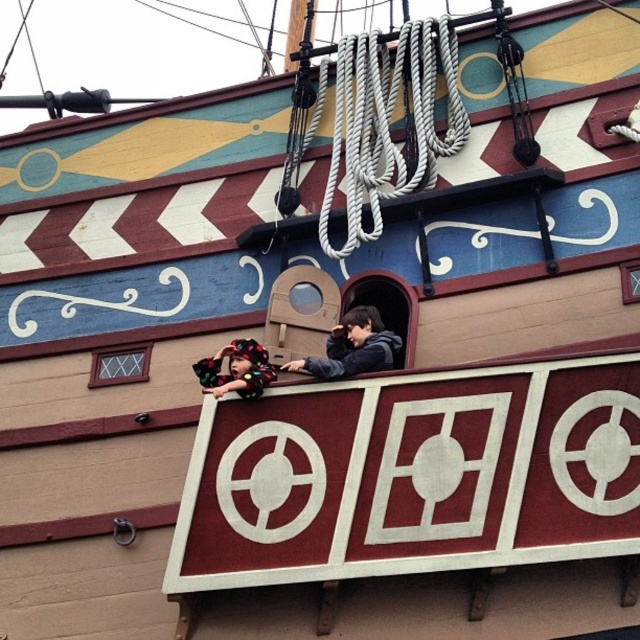
Question: Does fluffy multicolored blanket at center lie in front of fluffy hair at upper center?

Choices:
 (A) yes
 (B) no

Answer: (A)

Question: Which point appears farthest from the camera in this image?

Choices:
 (A) coord(387,358)
 (B) coord(291,364)

Answer: (A)

Question: Which of the following is the farthest from the observer?

Choices:
 (A) (198, 358)
 (B) (365, 317)
 (C) (348, 353)

Answer: (A)

Question: Which is nearer to the fluffy multicolored blanket at center?

Choices:
 (A) fluffy hair at upper center
 (B) dark gray hoodie at center

Answer: (A)

Question: Does fluffy multicolored blanket at center have a lesser width compared to fluffy hair at upper center?

Choices:
 (A) no
 (B) yes

Answer: (A)

Question: In this image, where is fluffy multicolored blanket at center located relative to fluffy hair at upper center?

Choices:
 (A) right
 (B) left

Answer: (A)